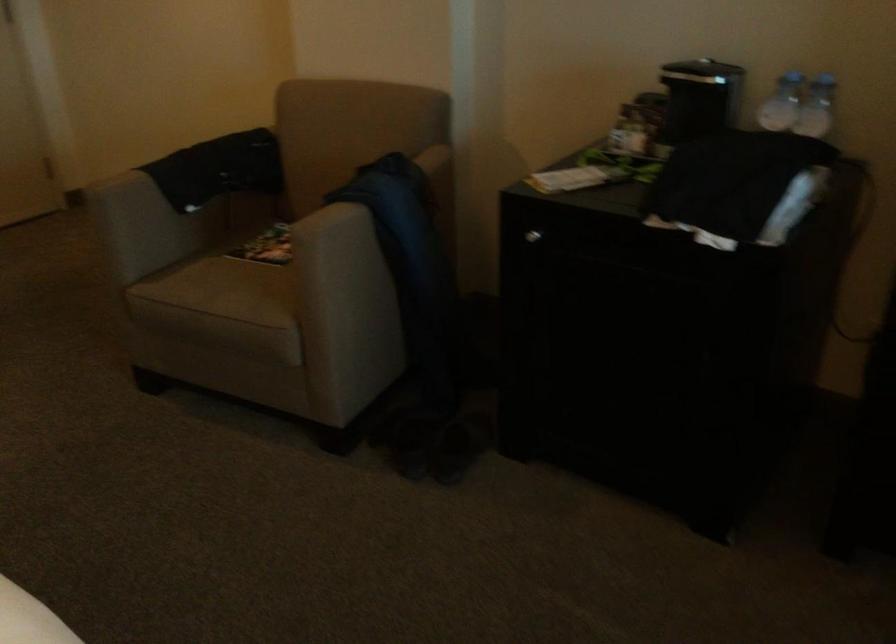
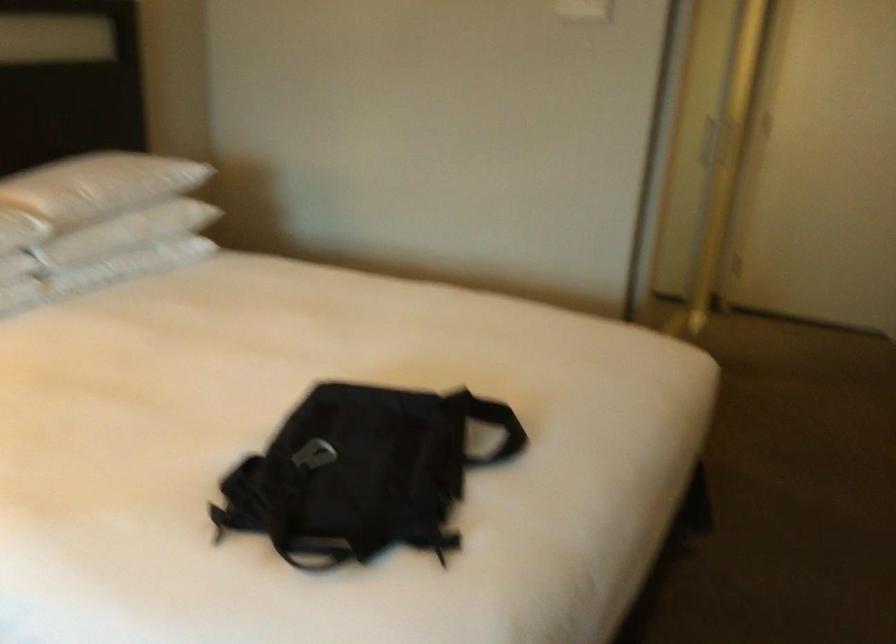
Question: The camera is either moving clockwise (left) or counter-clockwise (right) around the object. The first image is from the beginning of the video and the second image is from the end. Is the camera moving left or right when shooting the video?

Choices:
 (A) Left
 (B) Right

Answer: (B)